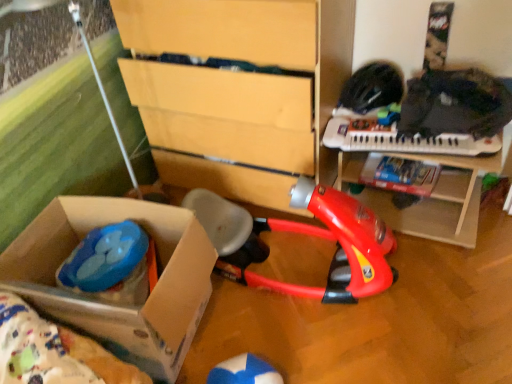
Question: Is red plastic vacuum cleaner at center, placed as the second toy when sorted from left to right, to the left or to the right of white plastic keyboard at upper right in the image?

Choices:
 (A) left
 (B) right

Answer: (A)

Question: From the image's perspective, is red plastic vacuum cleaner at center, placed as the second toy when sorted from left to right, above or below white plastic keyboard at upper right?

Choices:
 (A) below
 (B) above

Answer: (A)

Question: Which of these objects is positioned closest to the matte yellow chest of drawers at center?

Choices:
 (A) cardboard box at lower left
 (B) red plastic vacuum cleaner at center, the 1th toy positioned from the right
 (C) white plastic keyboard at upper right
 (D) wooden toy table at center
 (E) blue plastic toy at lower left, which is the second toy from right to left

Answer: (B)

Question: Which is nearer to the red plastic vacuum cleaner at center, the 1th toy positioned from the right?

Choices:
 (A) matte yellow chest of drawers at center
 (B) white plastic keyboard at upper right
 (C) blue plastic toy at lower left, which is the first toy from left to right
 (D) cardboard box at lower left
 (E) wooden toy table at center

Answer: (E)